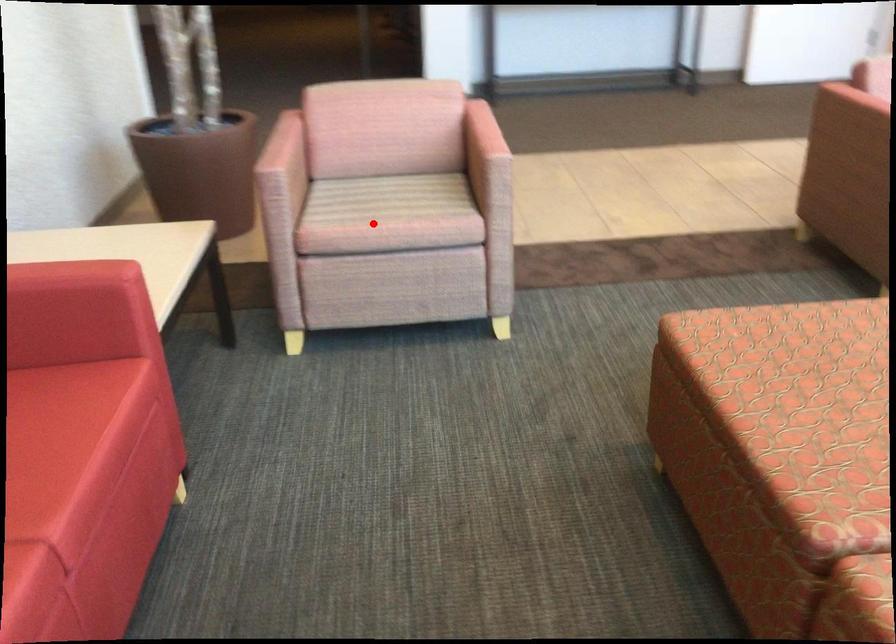
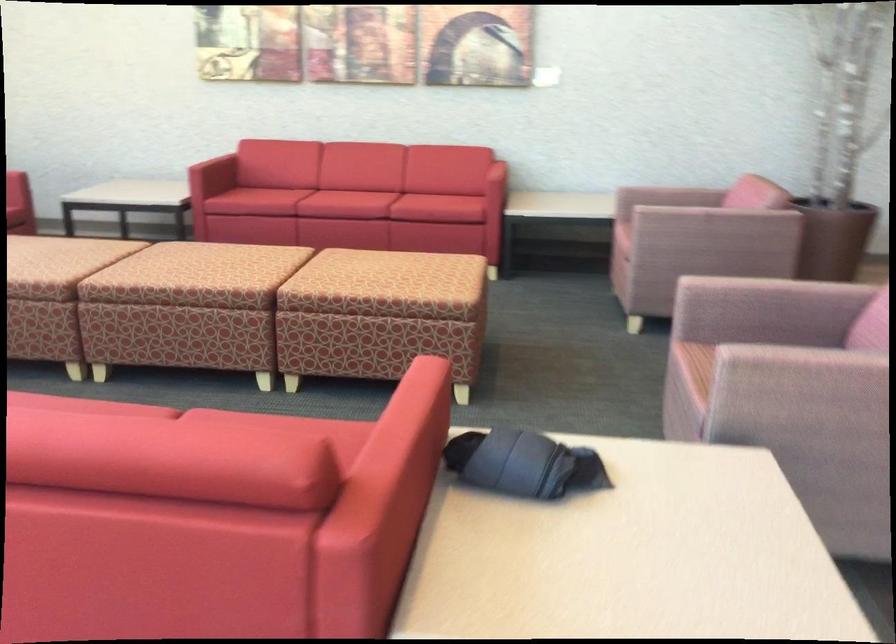
Find the pixel in the second image that matches the highlighted location in the first image.

(624, 218)